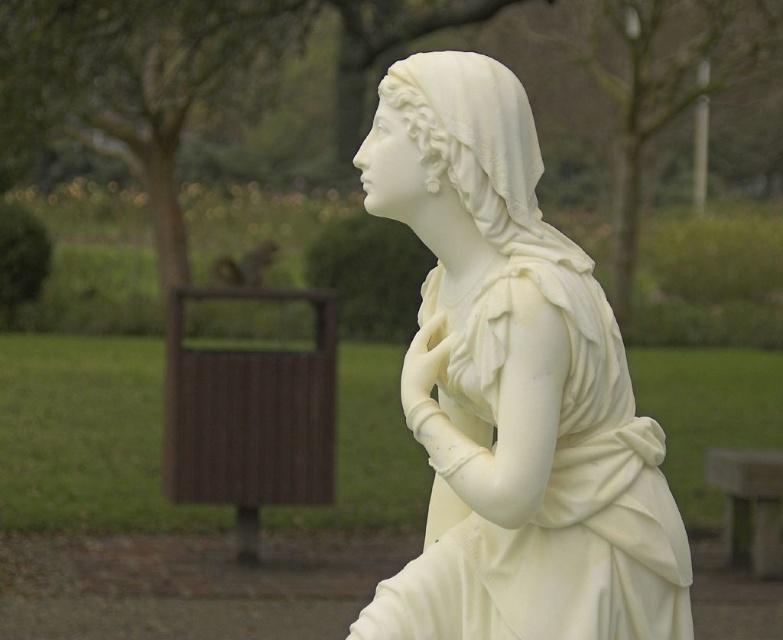
Can you confirm if white marble statue at center is shorter than smooth gray stone bench at lower right?

No.

Can you confirm if white marble statue at center is positioned to the left of smooth gray stone bench at lower right?

Correct, you'll find white marble statue at center to the left of smooth gray stone bench at lower right.

Does point (413, 209) lie behind point (740, 458)?

No, it is not.

Where is `white marble statue at center`? white marble statue at center is located at coordinates (513, 388).